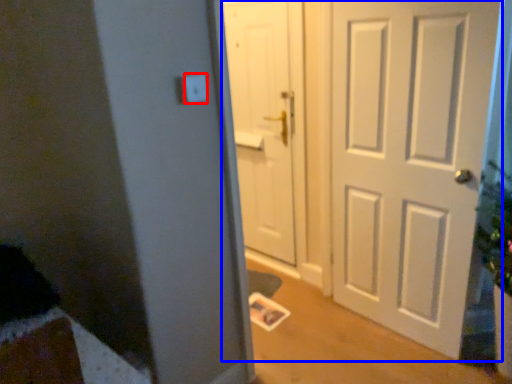
Question: Which point is closer to the camera, light switch (highlighted by a red box) or door (highlighted by a blue box)?

Choices:
 (A) light switch
 (B) door

Answer: (A)